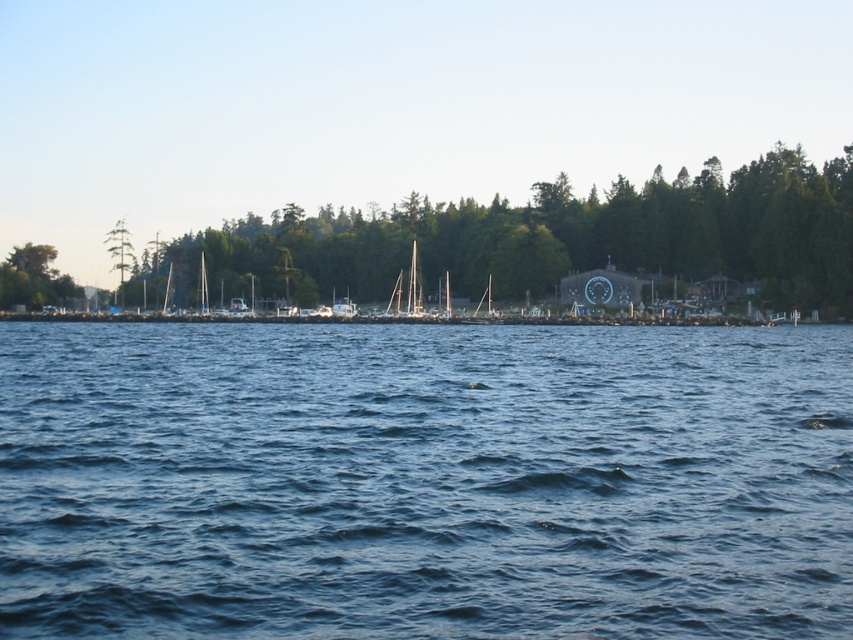
Does green leafy trees at center have a larger size compared to green leafy tree at left?

Indeed, green leafy trees at center has a larger size compared to green leafy tree at left.

Who is more forward, [392,272] or [61,292]?

Point [392,272] is in front.

Which is in front, point (292, 211) or point (10, 285)?

Point (10, 285)

Identify the location of green leafy trees at center. (566, 236).

Does green leafy trees at center appear over white matte sailboat at center?

Correct, green leafy trees at center is located above white matte sailboat at center.

Measure the distance from green leafy trees at center to white matte sailboat at center.

87.58 feet

Describe the element at coordinates (566, 236) in the screenshot. Image resolution: width=853 pixels, height=640 pixels. I see `green leafy trees at center` at that location.

This screenshot has height=640, width=853. What are the coordinates of `green leafy trees at center` in the screenshot? It's located at (566, 236).

Is green leafy tree at left below white matte sailboat at center?

Result: Actually, green leafy tree at left is above white matte sailboat at center.

Is green leafy tree at left closer to the viewer compared to white matte sailboat at center?

No, green leafy tree at left is further to the viewer.

Describe the element at coordinates (33, 278) in the screenshot. I see `green leafy tree at left` at that location.

Where is `green leafy tree at left`? green leafy tree at left is located at coordinates (33, 278).